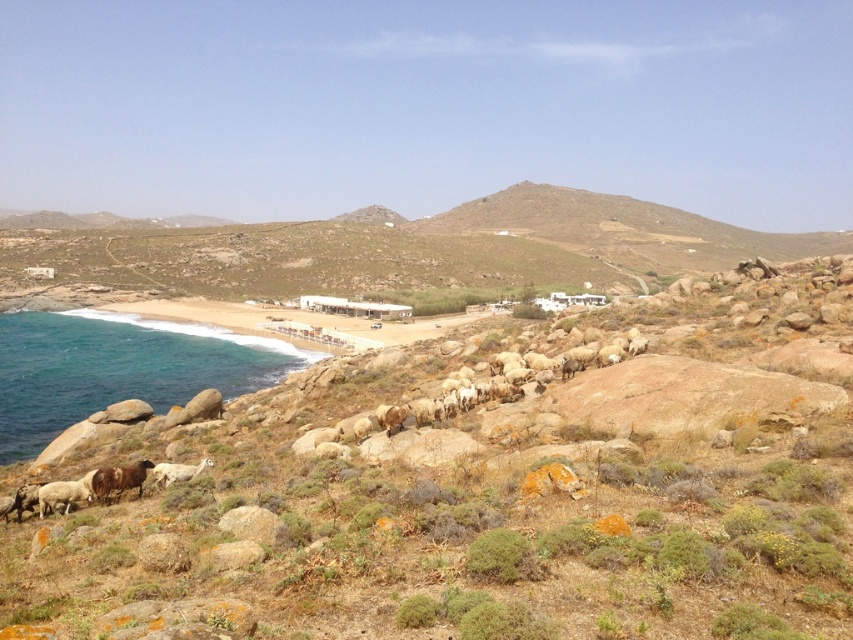
You are standing on the beach looking towards the brown rocky hillside at center and the white woolly sheep at lower center. Which object is closer to you?

The white woolly sheep at lower center is closer to you because the brown rocky hillside at center is further away.

You are standing at the point closer to the camera between the two points, point (300,364) and point (204,465). Which point are you standing at?

You are standing at point (300,364) because it is further to the camera than point (204,465).

You are a photographer standing at the edge of the beach. You want to take a photo that includes both the blue water at lower left and the white woolly sheep at lower center. Based on their positions, which object should appear lower in the photo?

The white woolly sheep at lower center should appear lower in the photo because the blue water at lower left is located above it, meaning the sheep is positioned below the water in the image.